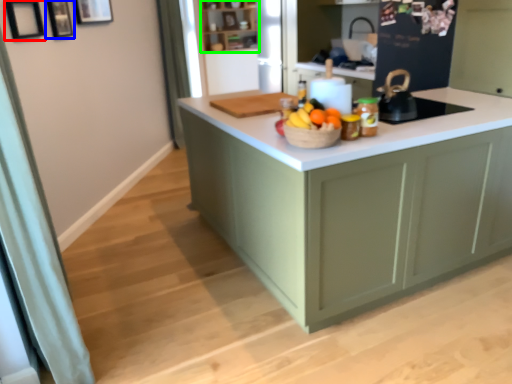
Question: Which is farther away from picture frame (highlighted by a red box)? picture frame (highlighted by a blue box) or shelf (highlighted by a green box)?

Choices:
 (A) picture frame
 (B) shelf

Answer: (B)